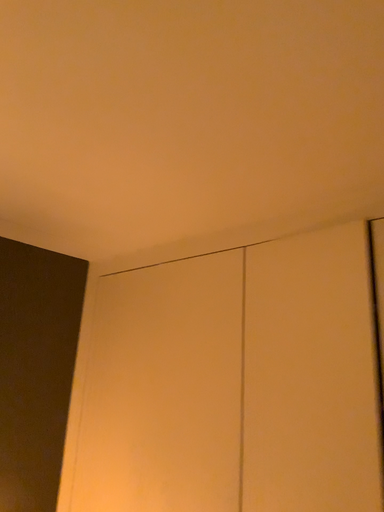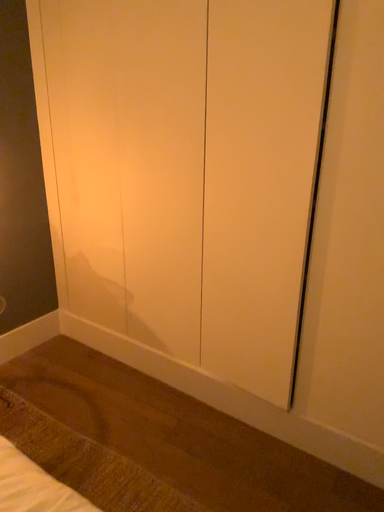
Question: Which way did the camera rotate in the video?

Choices:
 (A) rotated upward
 (B) rotated downward

Answer: (B)